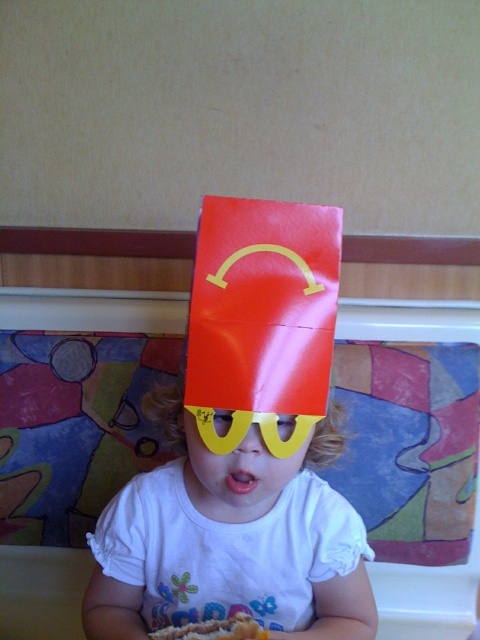
Question: Can you confirm if white matte shirt at center is bigger than yellow plastic glasses at center?

Choices:
 (A) no
 (B) yes

Answer: (B)

Question: Among these points, which one is nearest to the camera?

Choices:
 (A) (253, 621)
 (B) (160, 605)
 (C) (243, 499)

Answer: (C)

Question: Can you confirm if white matte shirt at center is positioned below yellow plastic glasses at center?

Choices:
 (A) no
 (B) yes

Answer: (B)

Question: Which object appears farthest from the camera in this image?

Choices:
 (A) white matte shirt at center
 (B) yellow plastic glasses at center

Answer: (A)

Question: In this image, where is yellow plastic glasses at center located relative to golden crispy french fries at lower center?

Choices:
 (A) left
 (B) right

Answer: (B)

Question: Considering the real-world distances, which object is farthest from the yellow plastic glasses at center?

Choices:
 (A) white matte shirt at center
 (B) golden crispy french fries at lower center

Answer: (B)